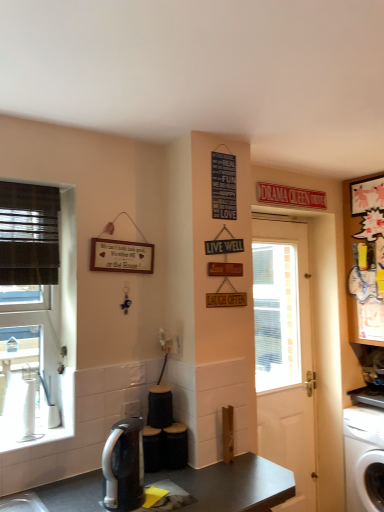
The width and height of the screenshot is (384, 512). I want to click on vacant space underneath sleek silver coffee maker at lower center (from a real-world perspective), so click(x=136, y=502).